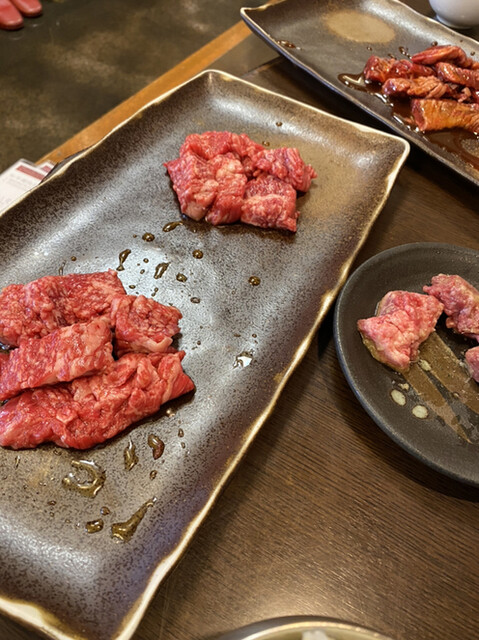
Locate an element on the screen. The image size is (479, 640). griddle is located at coordinates (79, 61).